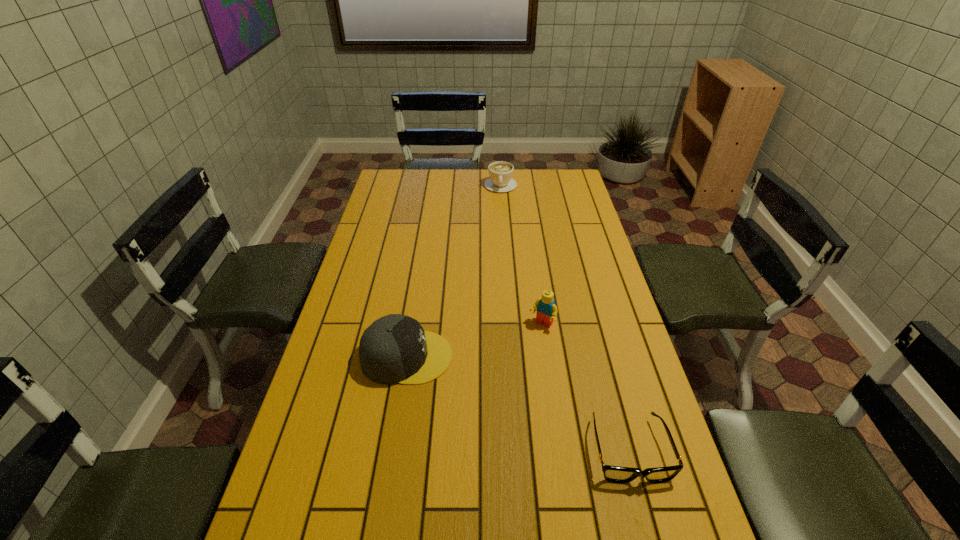
Find the location of `vacant space located on the front-facing side of the Lego`. vacant space located on the front-facing side of the Lego is located at coordinates (519, 354).

Image resolution: width=960 pixels, height=540 pixels. Find the location of `vacant region located to the right of the farthest object's handle`. vacant region located to the right of the farthest object's handle is located at coordinates (503, 217).

The width and height of the screenshot is (960, 540). Find the location of `vacant space located 0.130m to the right of the farthest object's handle`. vacant space located 0.130m to the right of the farthest object's handle is located at coordinates (502, 211).

I want to click on blank space located 0.330m to the right of the farthest object's handle, so click(504, 239).

Locate an element on the screen. The height and width of the screenshot is (540, 960). object present at the far edge is located at coordinates (500, 172).

Image resolution: width=960 pixels, height=540 pixels. Identify the location of object present at the left edge. (394, 349).

Where is `object at the right edge`? object at the right edge is located at coordinates (615, 474).

In the image, there is a desktop. Where is `vacant space at the far edge`? This screenshot has width=960, height=540. vacant space at the far edge is located at coordinates (522, 180).

The height and width of the screenshot is (540, 960). In the image, there is a desktop. Identify the location of vacant space at the left edge. (397, 239).

At what (x,y) coordinates should I click in order to perform the action: click on vacant area at the right edge of the desktop. Please return your answer as a coordinate pair (x, y). Image resolution: width=960 pixels, height=540 pixels. Looking at the image, I should click on (629, 447).